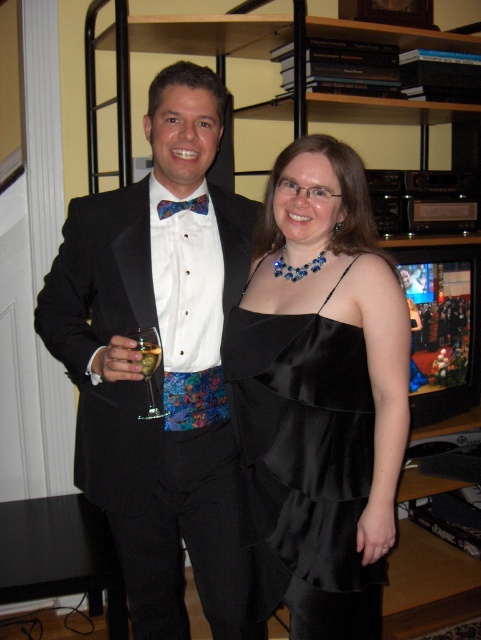
What do you see at coordinates (303, 468) in the screenshot? The width and height of the screenshot is (481, 640). I see `satin black dress at center` at bounding box center [303, 468].

How much distance is there between satin black dress at center and clear glass wine glass at left?

The distance of satin black dress at center from clear glass wine glass at left is 13.21 inches.

At what (x,y) coordinates should I click in order to perform the action: click on satin black dress at center. Please return your answer as a coordinate pair (x, y). This screenshot has height=640, width=481. Looking at the image, I should click on (303, 468).

You are a GUI agent. You are given a task and a screenshot of the screen. Output one action in this format:
    pyautogui.click(x=<x>, y=<y>)
    Task: Click on the satin black dress at center
    
    Given the screenshot: What is the action you would take?
    pyautogui.click(x=303, y=468)

Can you confirm if satin black dress at center is positioned above multicolored fabric bow tie at center?

No.

Is point (347, 637) positioned in front of point (193, 208)?

Yes.

Measure the distance between satin black dress at center and camera.

satin black dress at center is 4.18 feet away from camera.

Locate an element on the screen. The height and width of the screenshot is (640, 481). satin black dress at center is located at coordinates (303, 468).

Is translucent glass wine at center below multicolored fabric bow tie at center?

Yes, translucent glass wine at center is below multicolored fabric bow tie at center.

At what (x,y) coordinates should I click in order to perform the action: click on translucent glass wine at center. Please return your answer as a coordinate pair (x, y). The width and height of the screenshot is (481, 640). Looking at the image, I should click on (149, 353).